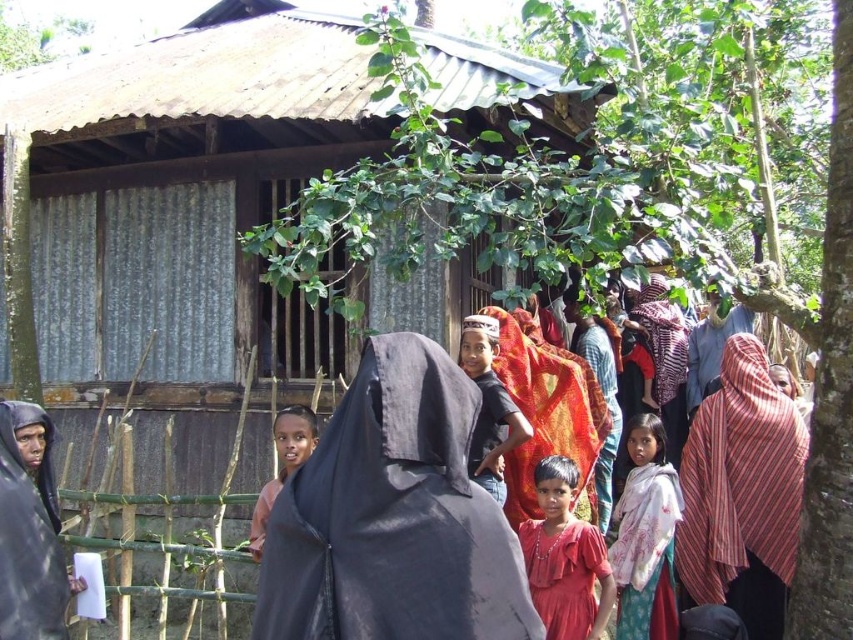
Who is taller, striped fabric headscarf at center or white floral fabric at center?

With more height is striped fabric headscarf at center.

Can you confirm if striped fabric headscarf at center is positioned to the left of white floral fabric at center?

In fact, striped fabric headscarf at center is to the right of white floral fabric at center.

Which is behind, point (786, 572) or point (660, 602)?

The point (786, 572) is behind.

Identify the location of striped fabric headscarf at center. (741, 493).

Is corrugated metal hut at center below striped fabric headscarf at center?

No.

Who is more distant from viewer, (310,330) or (753,627)?

Point (310,330)

Is point (495, 81) positioned before point (759, 499)?

No, it is not.

Find the location of a particular element. The width and height of the screenshot is (853, 640). corrugated metal hut at center is located at coordinates (184, 200).

Between point (424, 444) and point (666, 536), which one is positioned behind?

The point (666, 536) is more distant.

Is black matte veil at center positioned before white floral fabric at center?

Yes, black matte veil at center is closer to the viewer.

Between point (447, 449) and point (663, 637), which one is positioned behind?

Positioned behind is point (663, 637).

At what (x,y) coordinates should I click in order to perform the action: click on black matte veil at center. Please return your answer as a coordinate pair (x, y). The height and width of the screenshot is (640, 853). Looking at the image, I should click on (393, 516).